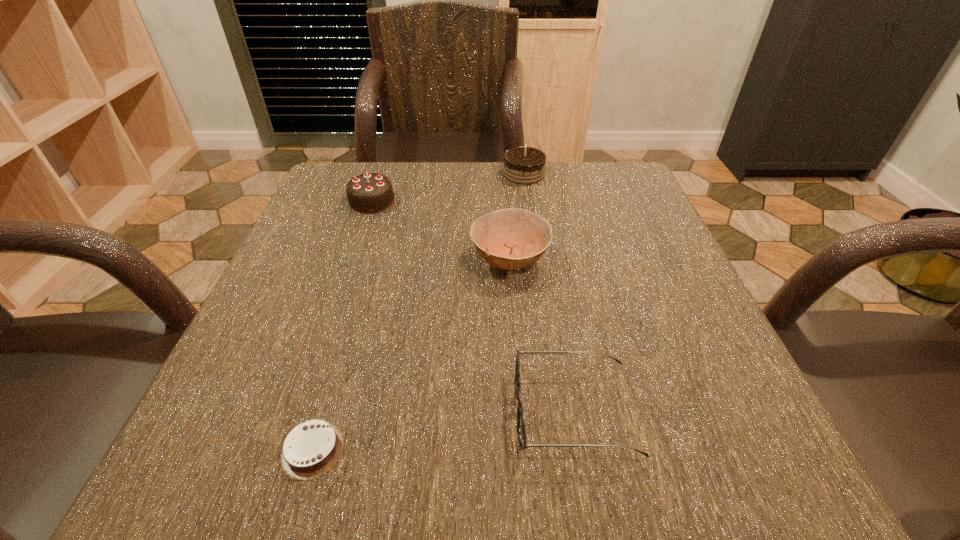
The width and height of the screenshot is (960, 540). I want to click on vacant space positioned through the lenses of the spectacles, so click(x=297, y=413).

Locate an element on the screen. vacant point located through the lenses of the spectacles is located at coordinates (428, 413).

Find the location of a particular element. vacant space located 0.190m through the lenses of the spectacles is located at coordinates (377, 413).

What are the coordinates of `free location located on the right of the shortest chocolate cake` in the screenshot? It's located at (623, 449).

Find the location of a particular element. The width and height of the screenshot is (960, 540). spectacles present at the near edge is located at coordinates (521, 409).

Where is `chocolate cake present at the near edge`? chocolate cake present at the near edge is located at coordinates (312, 448).

Identify the location of object located at the far left corner. This screenshot has height=540, width=960. (372, 192).

Image resolution: width=960 pixels, height=540 pixels. What are the coordinates of `object present at the near left corner` in the screenshot? It's located at (312, 448).

This screenshot has width=960, height=540. In the image, there is a desktop. Find the location of `vacant area at the far edge`. vacant area at the far edge is located at coordinates (484, 208).

In the image, there is a desktop. In order to click on blank space at the near edge in this screenshot , I will do pyautogui.click(x=492, y=448).